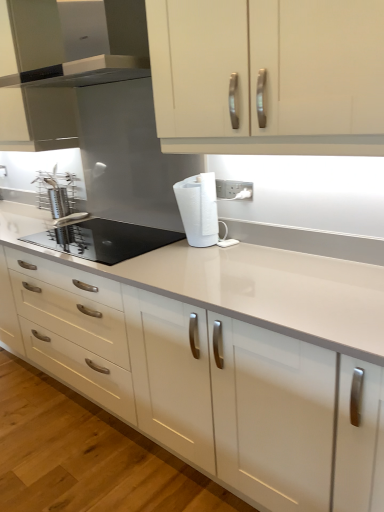
Question: Is satin silver range hood at upper left at the back of white matte paper towel at center?

Choices:
 (A) yes
 (B) no

Answer: (B)

Question: From a real-world perspective, is white matte paper towel at center positioned under satin silver range hood at upper left based on gravity?

Choices:
 (A) yes
 (B) no

Answer: (A)

Question: From the image's perspective, does white matte paper towel at center appear lower than satin silver range hood at upper left?

Choices:
 (A) no
 (B) yes

Answer: (B)

Question: Are white matte paper towel at center and satin silver range hood at upper left far apart?

Choices:
 (A) yes
 (B) no

Answer: (B)

Question: Is white matte paper towel at center shorter than satin silver range hood at upper left?

Choices:
 (A) yes
 (B) no

Answer: (A)

Question: Is satin silver range hood at upper left surrounded by white matte paper towel at center?

Choices:
 (A) yes
 (B) no

Answer: (B)

Question: Is matte white cabinet at upper center, which appears as the first cabinetry when viewed from the left, facing away from white glossy cabinet doors at upper center, which is the 2th cabinetry from left to right?

Choices:
 (A) no
 (B) yes

Answer: (A)

Question: Is matte white cabinet at upper center, which is counted as the first cabinetry, starting from the back, aimed at white glossy cabinet doors at upper center, which is the 2th cabinetry from left to right?

Choices:
 (A) no
 (B) yes

Answer: (A)

Question: From a real-world perspective, is matte white cabinet at upper center, which appears as the first cabinetry when viewed from the left, physically below white glossy cabinet doors at upper center, placed as the second cabinetry when sorted from back to front?

Choices:
 (A) no
 (B) yes

Answer: (A)

Question: From a real-world perspective, does matte white cabinet at upper center, which appears as the first cabinetry when viewed from the left, stand above white glossy cabinet doors at upper center, which appears as the 1th cabinetry when viewed from the front?

Choices:
 (A) yes
 (B) no

Answer: (A)

Question: Considering the relative sizes of matte white cabinet at upper center, the second cabinetry in the front-to-back sequence, and white glossy cabinet doors at upper center, which appears as the 1th cabinetry when viewed from the front, in the image provided, is matte white cabinet at upper center, the second cabinetry in the front-to-back sequence, shorter than white glossy cabinet doors at upper center, which appears as the 1th cabinetry when viewed from the front,?

Choices:
 (A) yes
 (B) no

Answer: (B)

Question: Can you confirm if matte white cabinet at upper center, which ranks as the 2th cabinetry in right-to-left order, is thinner than white glossy cabinet doors at upper center, placed as the second cabinetry when sorted from back to front?

Choices:
 (A) no
 (B) yes

Answer: (A)

Question: From the image's perspective, is matte white cabinet at upper center, which appears as the first cabinetry when viewed from the left, on top of white matte paper towel at center?

Choices:
 (A) no
 (B) yes

Answer: (B)